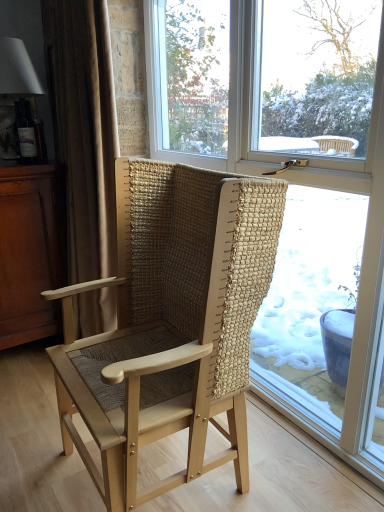
Question: Considering the positions of dark brown wood dresser at left and transparent glass window at center in the image, is dark brown wood dresser at left wider or thinner than transparent glass window at center?

Choices:
 (A) thin
 (B) wide

Answer: (B)

Question: From the image's perspective, is dark brown wood dresser at left positioned above or below transparent glass window at center?

Choices:
 (A) above
 (B) below

Answer: (B)

Question: Which is farther from the beige fabric curtain at left?

Choices:
 (A) natural woven wood chair at center
 (B) transparent glass window at center
 (C) dark brown wood dresser at left
 (D) matte white lampshade at upper left

Answer: (B)

Question: Based on their relative distances, which object is farther from the beige fabric curtain at left?

Choices:
 (A) matte white lampshade at upper left
 (B) natural woven wood chair at center
 (C) transparent glass window at center
 (D) dark brown wood dresser at left

Answer: (C)